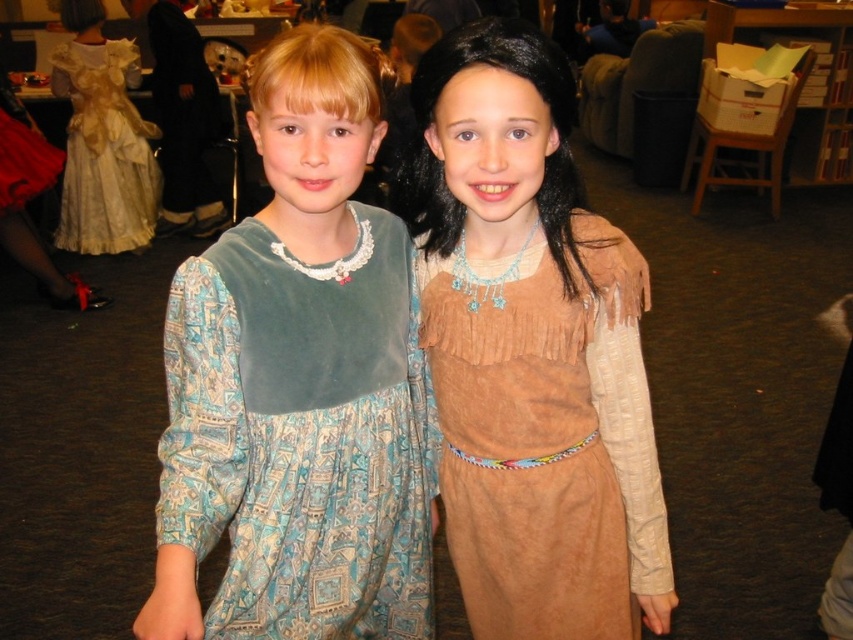
What is the position of the velvet dress at left in the image?

The velvet dress at left is located at point (299,384).